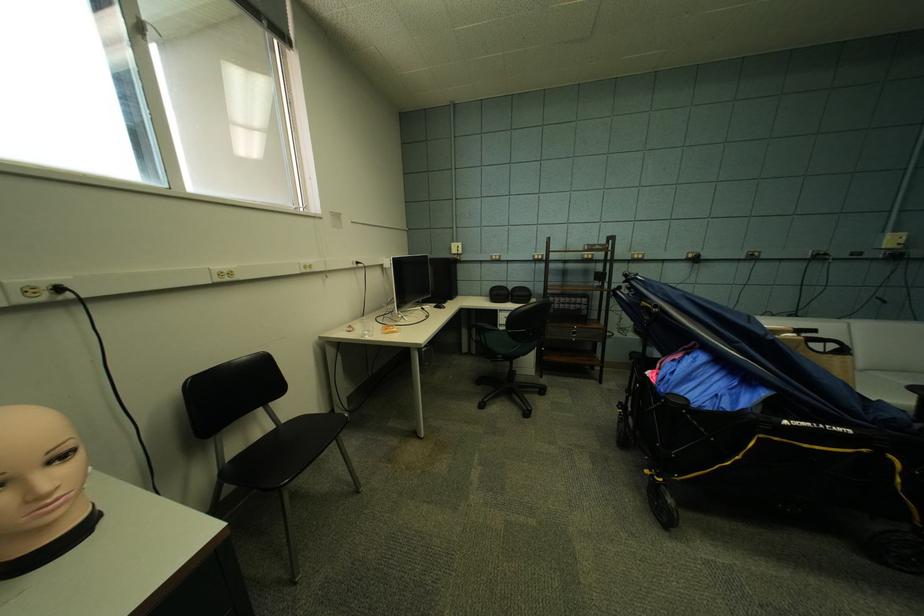
Where is `bag handle`? This screenshot has width=924, height=616. bag handle is located at coordinates (809, 328).